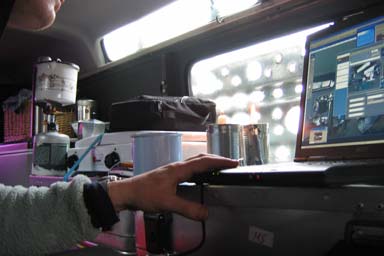
Image resolution: width=384 pixels, height=256 pixels. Find the location of `lights`. lights is located at coordinates (269, 106).